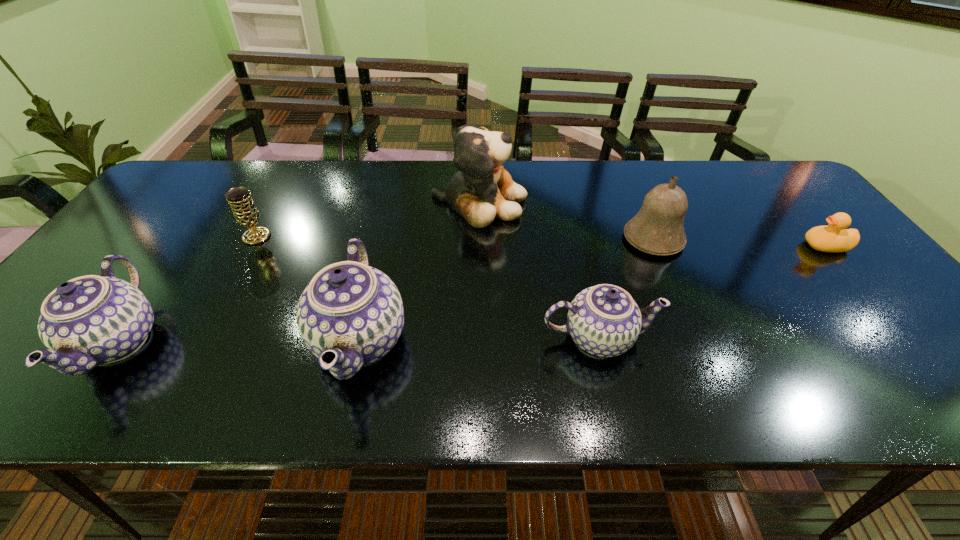
Image resolution: width=960 pixels, height=540 pixels. Find the location of `vacant place for an extra chinaware on the right`. vacant place for an extra chinaware on the right is located at coordinates pos(836,336).